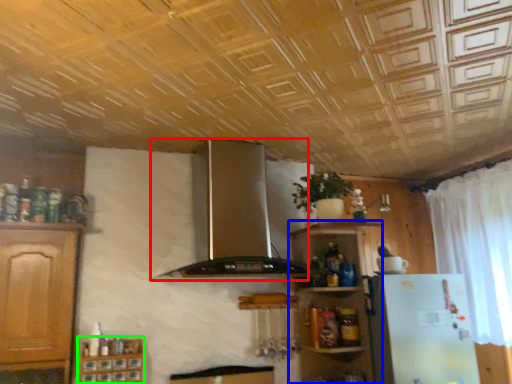
Question: Estimate the real-world distances between objects in this image. Which object is closer to exhaust hood (highlighted by a red box), shelf (highlighted by a blue box) or cabinetry (highlighted by a green box)?

Choices:
 (A) shelf
 (B) cabinetry

Answer: (A)